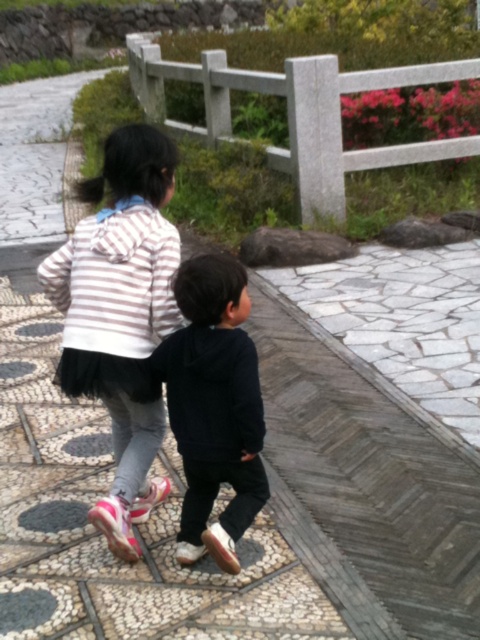
You are a photographer trying to capture both the striped hoodie at center and the dark blue hoodie at center in a single shot. Based on their positions, which hoodie will appear larger in the photo?

The striped hoodie at center appears larger in the photo because it is positioned over the dark blue hoodie at center, making it closer to the camera and thus larger in the frame.

You are standing at the starting point and see two points on the path. The first point is at coordinates point (58, 381) and the second point is at point (259, 426). Which point is closer to you?

Point (58, 381) is behind point (259, 426), so the closer point to you is point (259, 426).